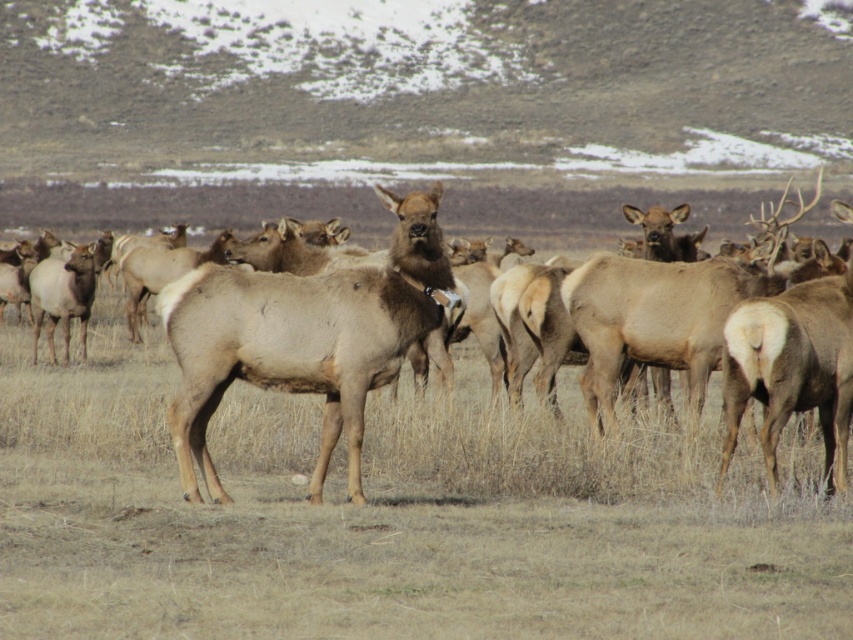
Who is higher up, brown matte/deer at center or brown fur deer at center?

brown matte/deer at center is above.

Which is in front, point (590, 440) or point (352, 320)?

Point (352, 320) is in front.

Locate an element on the screen. The width and height of the screenshot is (853, 640). brown matte/deer at center is located at coordinates (529, 444).